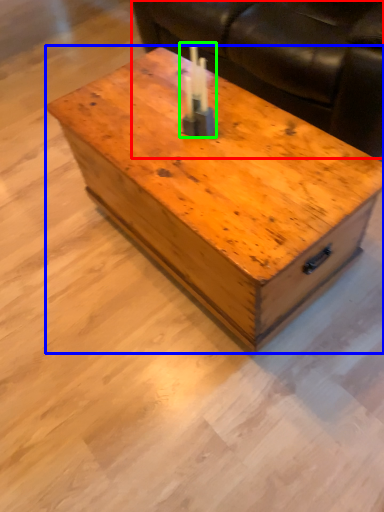
Question: Estimate the real-world distances between objects in this image. Which object is closer to couch (highlighted by a red box), coffee table (highlighted by a blue box) or birthday candle (highlighted by a green box)?

Choices:
 (A) coffee table
 (B) birthday candle

Answer: (A)